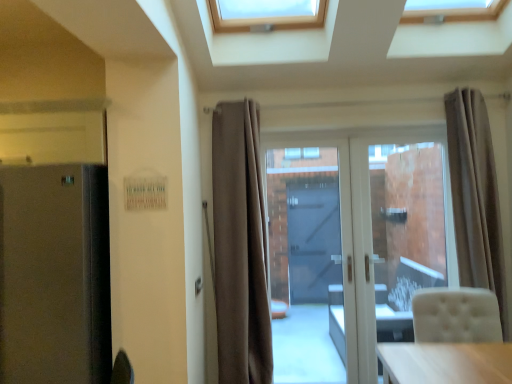
Question: Are white glossy door at center and satin black fridge at left making contact?

Choices:
 (A) no
 (B) yes

Answer: (A)

Question: Could you tell me if white glossy door at center is turned towards satin black fridge at left?

Choices:
 (A) no
 (B) yes

Answer: (A)

Question: Is white glossy door at center positioned behind satin black fridge at left?

Choices:
 (A) yes
 (B) no

Answer: (A)

Question: Is white glossy door at center not inside satin black fridge at left?

Choices:
 (A) no
 (B) yes

Answer: (B)

Question: Does white glossy door at center have a lesser width compared to satin black fridge at left?

Choices:
 (A) yes
 (B) no

Answer: (A)

Question: Is white glossy door at center bigger or smaller than satin black fridge at left?

Choices:
 (A) small
 (B) big

Answer: (A)

Question: In terms of height, does white glossy door at center look taller or shorter compared to satin black fridge at left?

Choices:
 (A) short
 (B) tall

Answer: (B)

Question: From the image's perspective, is white glossy door at center located above or below satin black fridge at left?

Choices:
 (A) above
 (B) below

Answer: (A)

Question: Is point (322, 178) positioned closer to the camera than point (97, 185)?

Choices:
 (A) farther
 (B) closer

Answer: (A)

Question: Would you say beige fabric curtain at right, the 2th curtain in the left-to-right sequence, is to the left or to the right of beige fabric curtain at center, the 1th curtain positioned from the left, in the picture?

Choices:
 (A) right
 (B) left

Answer: (A)

Question: From the image's perspective, is beige fabric curtain at right, which is the first curtain from right to left, located above or below beige fabric curtain at center, the 1th curtain positioned from the left?

Choices:
 (A) below
 (B) above

Answer: (B)

Question: Is beige fabric curtain at right, which is the first curtain from right to left, spatially inside beige fabric curtain at center, the 1th curtain positioned from the left, or outside of it?

Choices:
 (A) inside
 (B) outside

Answer: (B)

Question: Relative to beige fabric curtain at center, positioned as the 2th curtain in right-to-left order, is beige fabric curtain at right, the 2th curtain in the left-to-right sequence, in front or behind?

Choices:
 (A) behind
 (B) front

Answer: (B)

Question: Is satin black fridge at left in front of or behind transparent glass door at center in the image?

Choices:
 (A) front
 (B) behind

Answer: (A)

Question: Considering the relative positions of satin black fridge at left and transparent glass door at center in the image provided, is satin black fridge at left to the left or to the right of transparent glass door at center?

Choices:
 (A) left
 (B) right

Answer: (A)